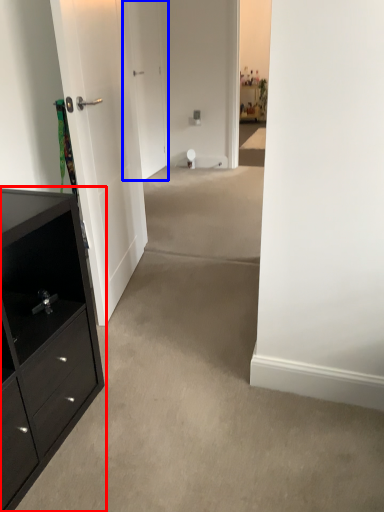
Question: Which point is closer to the camera, chest of drawers (highlighted by a red box) or door (highlighted by a blue box)?

Choices:
 (A) chest of drawers
 (B) door

Answer: (A)